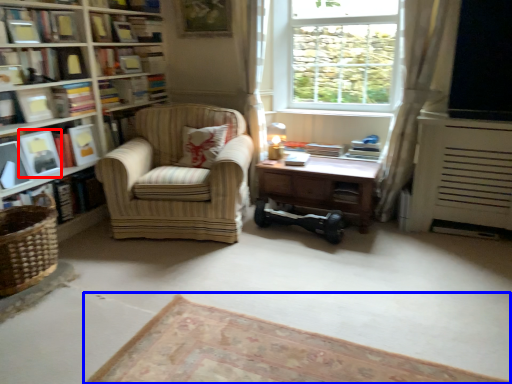
Question: Which point is further to the camera, paperback book (highlighted by a red box) or plain (highlighted by a blue box)?

Choices:
 (A) paperback book
 (B) plain

Answer: (A)